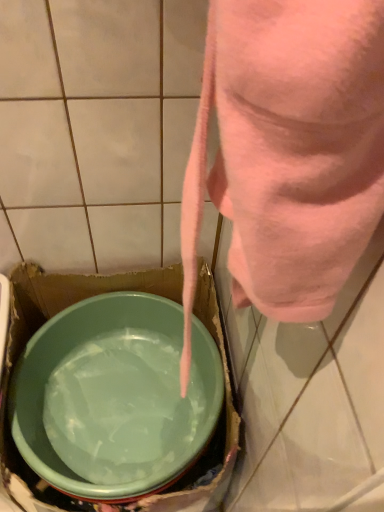
Describe the element at coordinates (114, 397) in the screenshot. This screenshot has height=512, width=384. I see `green matte mixing bowl at center` at that location.

What is the approximate width of green matte mixing bowl at center?

green matte mixing bowl at center is 18.17 inches in width.

Measure the distance between point (157, 375) and camera.

3.44 feet.

Identify the location of green matte mixing bowl at center. (114, 397).

Find the location of a particular element. This screenshot has width=384, height=512. green matte mixing bowl at center is located at coordinates (114, 397).